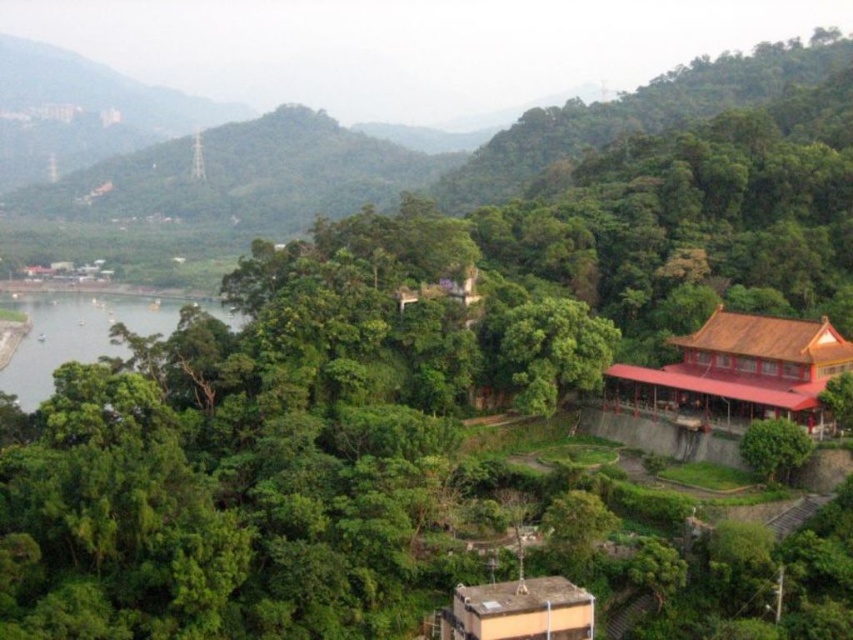
Can you confirm if green leafy river at lower left is thinner than green leafy tree at lower right?

No, green leafy river at lower left is not thinner than green leafy tree at lower right.

Does green leafy river at lower left have a greater height compared to green leafy tree at lower right?

Indeed, green leafy river at lower left has a greater height compared to green leafy tree at lower right.

This screenshot has height=640, width=853. In order to click on green leafy river at lower left in this screenshot , I will do (84, 333).

Can you confirm if green leafy river at lower left is shorter than green leafy tree at center?

In fact, green leafy river at lower left may be taller than green leafy tree at center.

Is green leafy river at lower left smaller than green leafy tree at center?

Incorrect, green leafy river at lower left is not smaller in size than green leafy tree at center.

Describe the element at coordinates (84, 333) in the screenshot. I see `green leafy river at lower left` at that location.

The height and width of the screenshot is (640, 853). I want to click on green leafy river at lower left, so click(84, 333).

Does green leafy tree at center appear on the right side of green leafy tree at lower right?

No, green leafy tree at center is not to the right of green leafy tree at lower right.

Which of these two, green leafy tree at center or green leafy tree at lower right, stands shorter?

green leafy tree at lower right is shorter.

Who is more forward, (553, 360) or (763, 445)?

Positioned in front is point (763, 445).

Where is `green leafy tree at center`? green leafy tree at center is located at coordinates (553, 352).